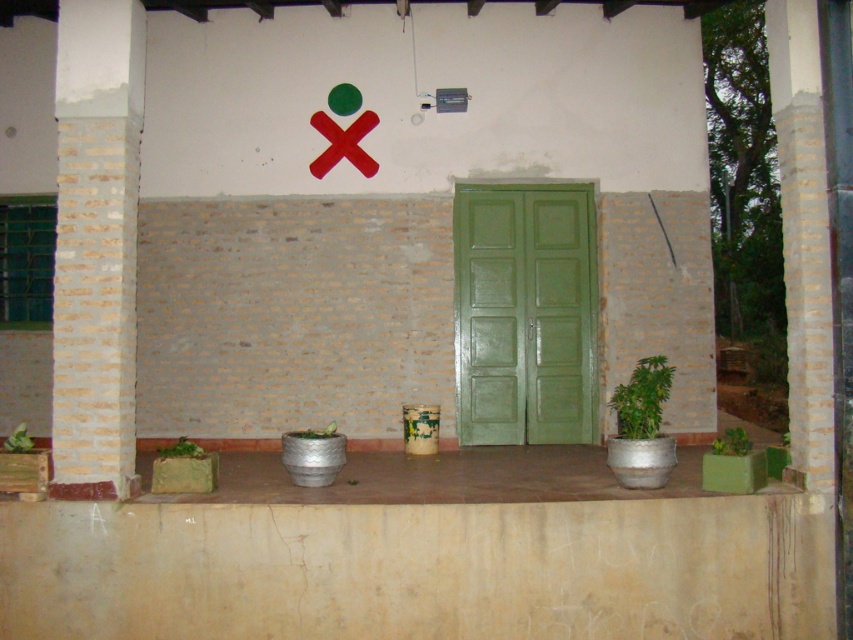
The width and height of the screenshot is (853, 640). What do you see at coordinates (525, 316) in the screenshot? I see `green painted wood door at center` at bounding box center [525, 316].

Is green painted wood door at center positioned in front of metallic silver pot at center?

No, green painted wood door at center is behind metallic silver pot at center.

Is point (519, 257) behind point (300, 492)?

Yes, point (519, 257) is farther from viewer.

Image resolution: width=853 pixels, height=640 pixels. I want to click on green painted wood door at center, so click(525, 316).

Can you confirm if green metallic pot at lower left is wider than green matte pot at lower left?

No.

Can you confirm if green metallic pot at lower left is shorter than green matte pot at lower left?

Yes.

Which is in front, point (193, 445) or point (15, 433)?

Point (15, 433)

Identify the location of green metallic pot at lower left. The width and height of the screenshot is (853, 640). (180, 449).

Between green metallic pot at right and green metallic pot at lower right, which one appears on the left side from the viewer's perspective?

Positioned to the left is green metallic pot at right.

Does green metallic pot at right appear under green metallic pot at lower right?

No, green metallic pot at right is not below green metallic pot at lower right.

Between point (619, 400) and point (735, 428), which one is positioned in front?

Point (619, 400) is more forward.

Locate an element on the screen. green metallic pot at right is located at coordinates (642, 397).